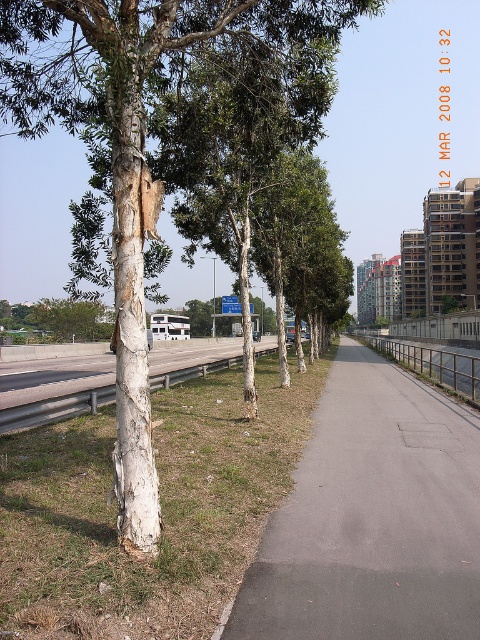
Question: Is green grass at lower left bigger than white rough bark tree at left?

Choices:
 (A) yes
 (B) no

Answer: (B)

Question: Which point is closer to the camera?

Choices:
 (A) white rough bark tree at left
 (B) gray asphalt pavement at center
 (C) green grass at lower left
 (D) green rough bark tree at left

Answer: (C)

Question: Which point is farther from the camera taking this photo?

Choices:
 (A) (43, 81)
 (B) (6, 609)
 (C) (43, 314)
 (D) (452, 547)

Answer: (C)

Question: Which point appears closest to the camera in this image?

Choices:
 (A) (85, 305)
 (B) (226, 627)
 (C) (27, 531)
 (D) (10, 99)

Answer: (B)

Question: Is white rough bark tree at left wider than green rough bark tree at left?

Choices:
 (A) no
 (B) yes

Answer: (A)

Question: Does gray asphalt pavement at center have a greater width compared to white rough bark tree at left?

Choices:
 (A) no
 (B) yes

Answer: (A)